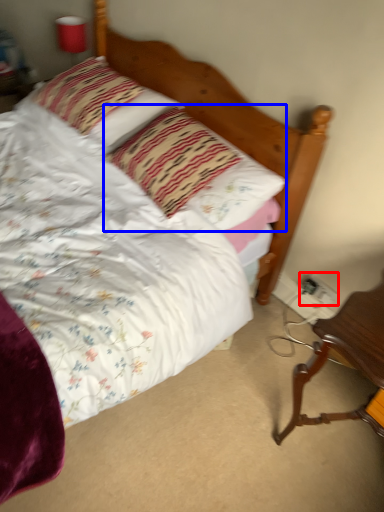
Question: Which point is further to the camera, electric outlet (highlighted by a red box) or pillow (highlighted by a blue box)?

Choices:
 (A) electric outlet
 (B) pillow

Answer: (A)